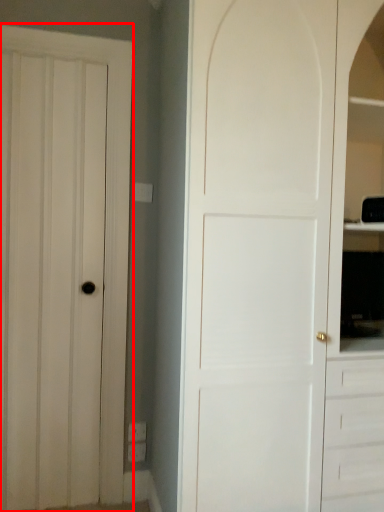
Question: Observing the image, what is the correct spatial positioning of door (annotated by the red box) in reference to door?

Choices:
 (A) left
 (B) right

Answer: (A)